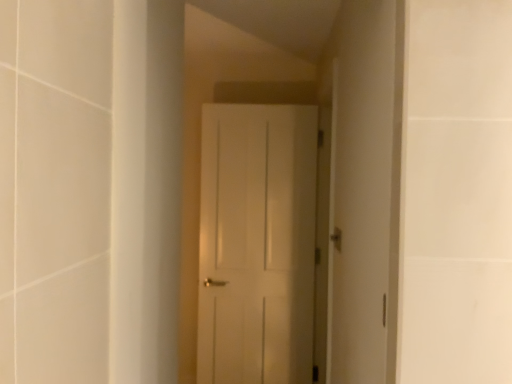
Question: Can we say gold metallic door handle at center lies outside white matte door at center?

Choices:
 (A) yes
 (B) no

Answer: (A)

Question: From a real-world perspective, is gold metallic door handle at center over white matte door at center?

Choices:
 (A) yes
 (B) no

Answer: (A)

Question: Is gold metallic door handle at center thinner than white matte door at center?

Choices:
 (A) yes
 (B) no

Answer: (A)

Question: Is gold metallic door handle at center positioned before white matte door at center?

Choices:
 (A) yes
 (B) no

Answer: (A)

Question: Are gold metallic door handle at center and white matte door at center beside each other?

Choices:
 (A) yes
 (B) no

Answer: (B)

Question: Is gold metallic door handle at center wider than white matte door at center?

Choices:
 (A) no
 (B) yes

Answer: (A)

Question: Is white matte door at center at the left side of gold metallic door handle at center?

Choices:
 (A) no
 (B) yes

Answer: (B)

Question: Is white matte door at center at the right side of gold metallic door handle at center?

Choices:
 (A) yes
 (B) no

Answer: (B)

Question: Is white matte door at center completely or partially outside of gold metallic door handle at center?

Choices:
 (A) no
 (B) yes

Answer: (B)

Question: From the image's perspective, is white matte door at center above gold metallic door handle at center?

Choices:
 (A) no
 (B) yes

Answer: (A)

Question: Does white matte door at center have a lesser height compared to gold metallic door handle at center?

Choices:
 (A) no
 (B) yes

Answer: (A)

Question: Considering the relative sizes of white matte door at center and gold metallic door handle at center in the image provided, is white matte door at center thinner than gold metallic door handle at center?

Choices:
 (A) no
 (B) yes

Answer: (A)

Question: From the image's perspective, is white matte door at center positioned above or below gold metallic door handle at center?

Choices:
 (A) above
 (B) below

Answer: (B)